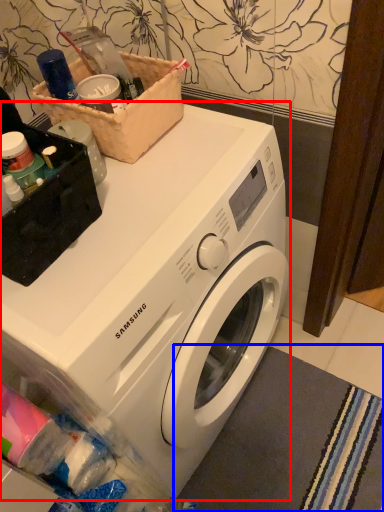
Question: Which object appears closest to the camera in this image, washing machine (highlighted by a red box) or bath mat (highlighted by a blue box)?

Choices:
 (A) washing machine
 (B) bath mat

Answer: (A)